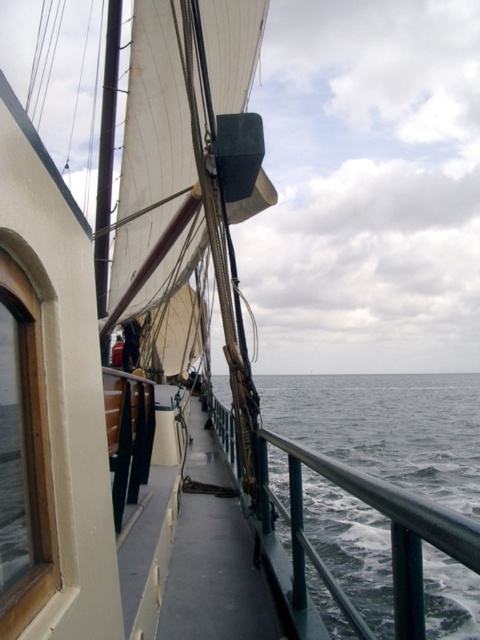
Does gray matte water at center lie behind dark blue fabric at center?

That is False.

Who is higher up, gray matte water at center or dark blue fabric at center?

dark blue fabric at center is higher up.

Between point (474, 435) and point (117, 348), which one is positioned behind?

The point (474, 435) is more distant.

Find the location of a particular element. The width and height of the screenshot is (480, 640). gray matte water at center is located at coordinates (387, 426).